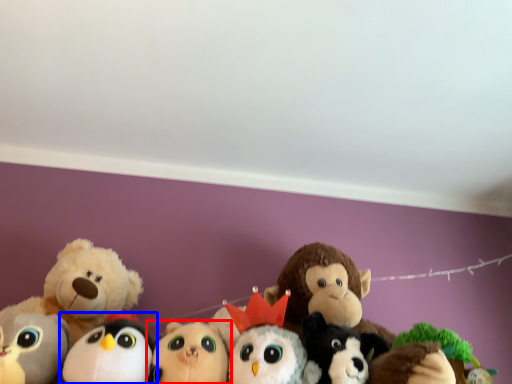
Question: Which of the following is the farthest to the observer, toy (highlighted by a red box) or toy (highlighted by a blue box)?

Choices:
 (A) toy
 (B) toy

Answer: (A)